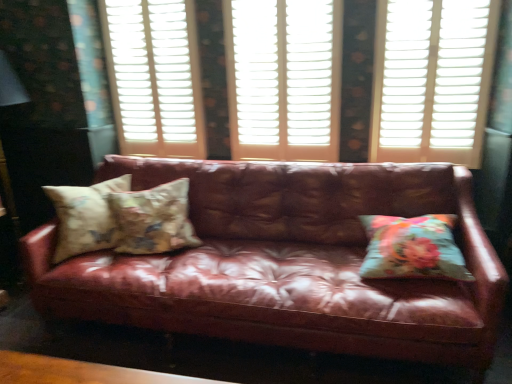
Where is `blank space above floral fabric pillow at right, which ranks as the first pillow in right-to-left order (from a real-world perspective)`? blank space above floral fabric pillow at right, which ranks as the first pillow in right-to-left order (from a real-world perspective) is located at coordinates (411, 225).